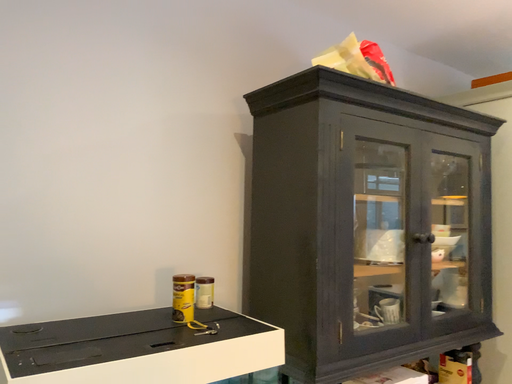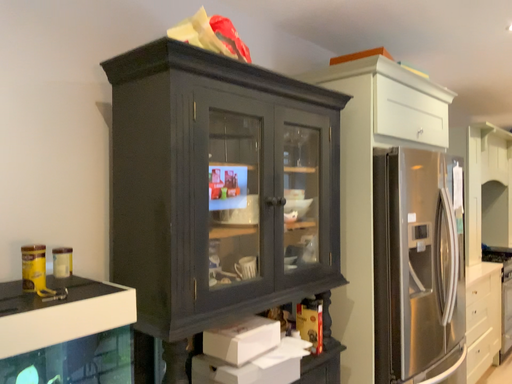
Question: How did the camera likely rotate when shooting the video?

Choices:
 (A) rotated right
 (B) rotated left

Answer: (A)